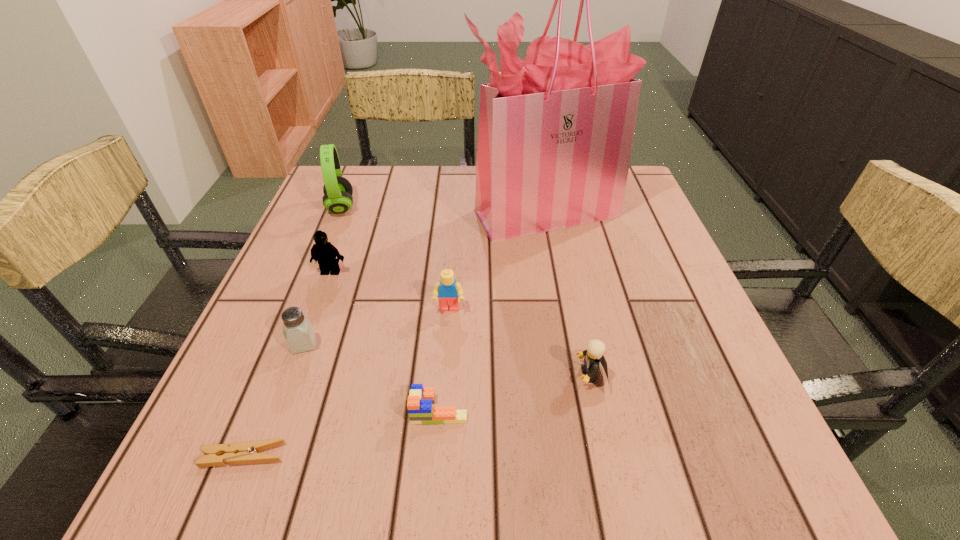
The width and height of the screenshot is (960, 540). In order to click on shopping bag in this screenshot , I will do `click(555, 135)`.

The height and width of the screenshot is (540, 960). In order to click on the seventh shortest object in this screenshot , I will do `click(337, 190)`.

The image size is (960, 540). I want to click on the third farthest object, so click(x=324, y=252).

At what (x,y) coordinates should I click in order to perform the action: click on the leftmost Lego. Please return your answer as a coordinate pair (x, y). The width and height of the screenshot is (960, 540). Looking at the image, I should click on (324, 252).

Where is `the fourth farthest object`? the fourth farthest object is located at coordinates (448, 290).

Identify the location of the rightmost Lego. (594, 356).

Locate an element on the screen. saltshaker is located at coordinates (298, 331).

Locate an element on the screen. the seventh tallest object is located at coordinates (420, 409).

This screenshot has height=540, width=960. I want to click on clothespin, so click(x=245, y=452).

Find the location of `the shortest object`. the shortest object is located at coordinates (245, 452).